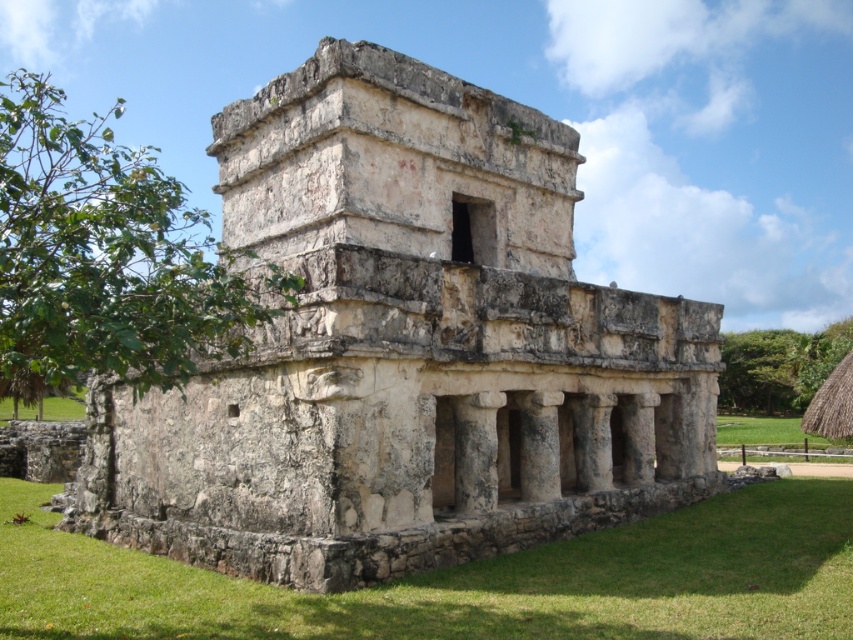
Question: Among these objects, which one is farthest from the camera?

Choices:
 (A) stone ruins at center
 (B) green grass at lower right

Answer: (B)

Question: Which point appears farthest from the camera in this image?

Choices:
 (A) (734, 440)
 (B) (662, 500)

Answer: (A)

Question: Is green grass at lower center below green grass at lower right?

Choices:
 (A) yes
 (B) no

Answer: (B)

Question: Does stone ruins at center appear on the left side of green grass at lower center?

Choices:
 (A) no
 (B) yes

Answer: (B)

Question: Is the position of stone ruins at center less distant than that of green grass at lower right?

Choices:
 (A) no
 (B) yes

Answer: (B)

Question: Which of the following is the farthest from the observer?

Choices:
 (A) (146, 412)
 (B) (817, 444)

Answer: (B)